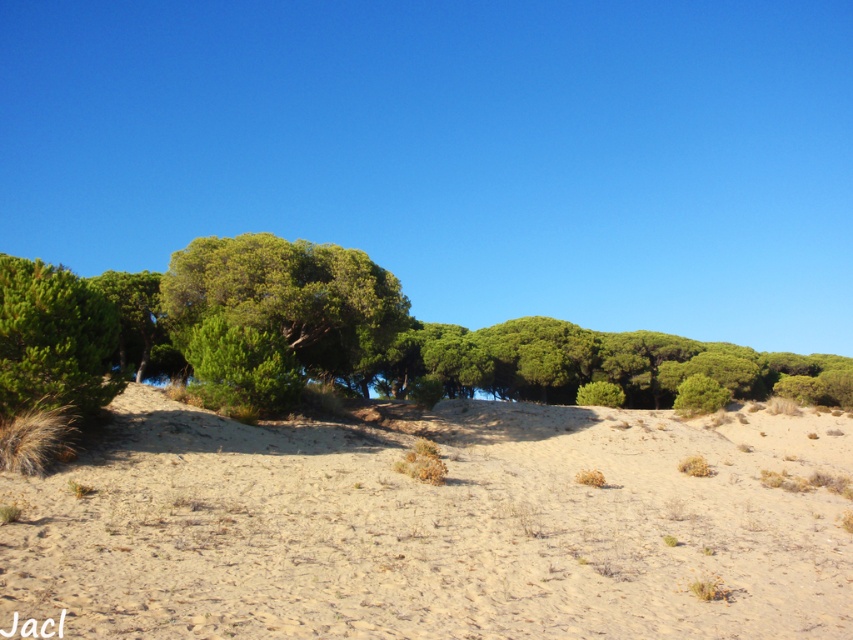
Question: Which point is farther to the camera?

Choices:
 (A) (28, 300)
 (B) (143, 536)
 (C) (523, 330)

Answer: (C)

Question: Does green leafy trees at center have a smaller size compared to green leafy tree at upper left?

Choices:
 (A) no
 (B) yes

Answer: (A)

Question: Which object is the closest to the green leafy tree at center?

Choices:
 (A) green leafy tree at upper left
 (B) light brown sandy at center

Answer: (B)

Question: Does green leafy trees at center come behind green leafy tree at upper left?

Choices:
 (A) no
 (B) yes

Answer: (B)

Question: Which point appears closest to the camera in this image?

Choices:
 (A) (54, 336)
 (B) (358, 365)
 (C) (643, 387)
 (D) (136, 417)

Answer: (A)

Question: Can you confirm if light brown sandy at center is wider than green leafy trees at center?

Choices:
 (A) yes
 (B) no

Answer: (B)